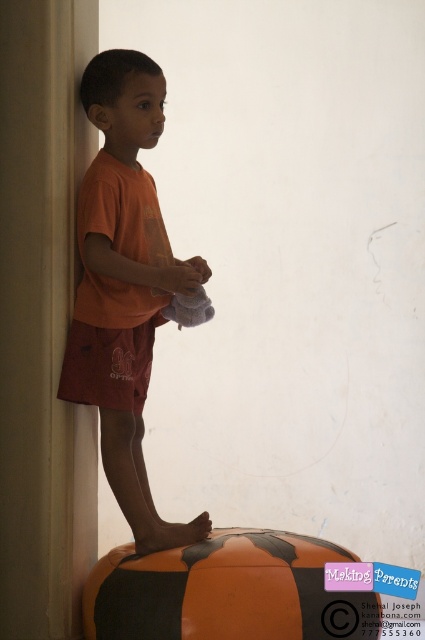
Question: Which point is closer to the camera?

Choices:
 (A) smooth beige pillar at left
 (B) orange cotton shirt at center

Answer: (A)

Question: Where is orange cotton shirt at center located in relation to orange matte beach ball at lower center in the image?

Choices:
 (A) right
 (B) left

Answer: (B)

Question: From the image, what is the correct spatial relationship of orange matte beach ball at lower center in relation to orange cotton shorts at lower left?

Choices:
 (A) below
 (B) above

Answer: (A)

Question: Is smooth beige pillar at left bigger than orange cotton shorts at lower left?

Choices:
 (A) no
 (B) yes

Answer: (B)

Question: Which object is positioned closest to the orange cotton shirt at center?

Choices:
 (A) orange cotton shorts at lower left
 (B) orange matte beach ball at lower center
 (C) smooth beige pillar at left

Answer: (A)

Question: Which object is the closest to the smooth beige pillar at left?

Choices:
 (A) orange cotton shorts at lower left
 (B) orange matte beach ball at lower center
 (C) orange cotton shirt at center

Answer: (C)